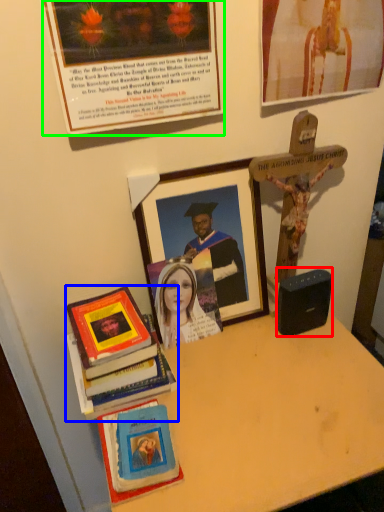
Question: Which object is positioned farthest from speaker (highlighted by a red box)? Select from book (highlighted by a blue box) and picture frame (highlighted by a green box).

Choices:
 (A) book
 (B) picture frame

Answer: (B)